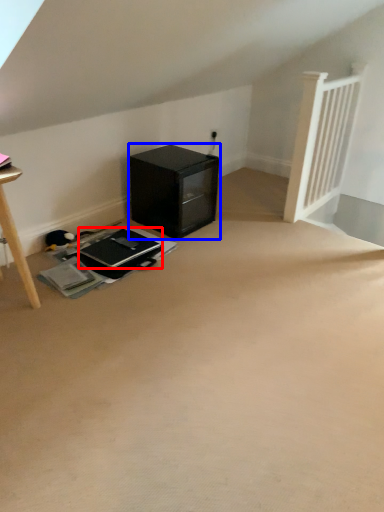
Question: Which object is closer to the camera taking this photo, laptop (highlighted by a red box) or furniture (highlighted by a blue box)?

Choices:
 (A) laptop
 (B) furniture

Answer: (A)